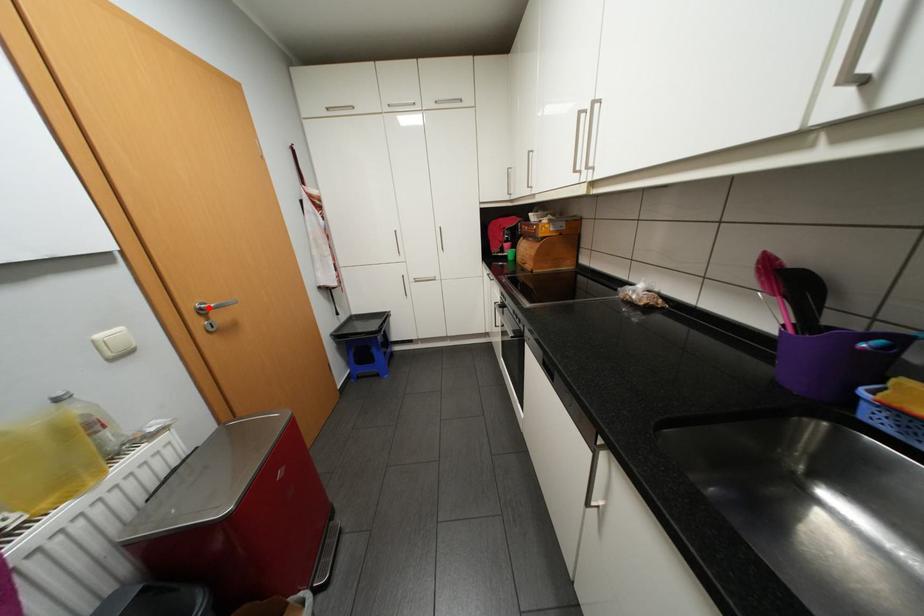
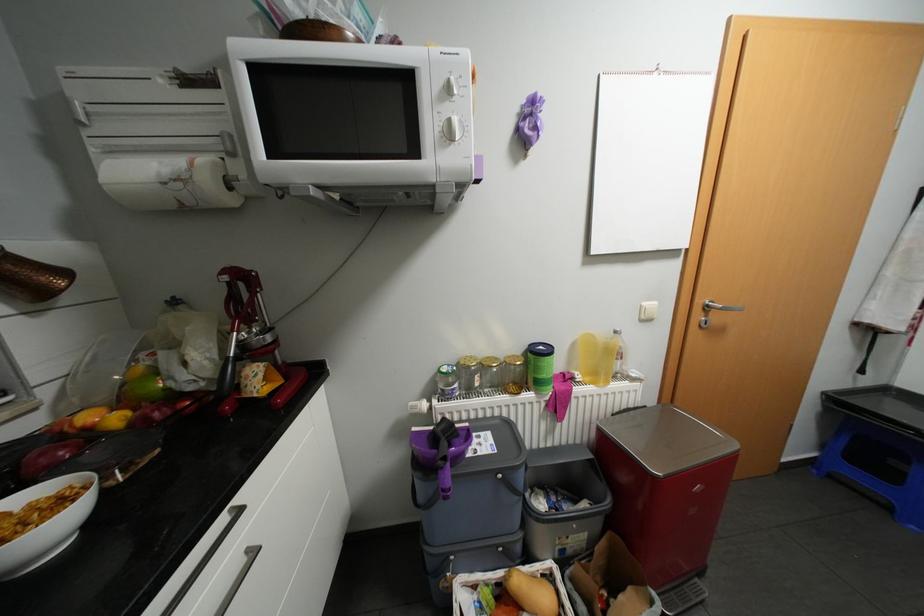
Where in the second image is the point corresponding to the highlighted location from the first image?

(715, 305)